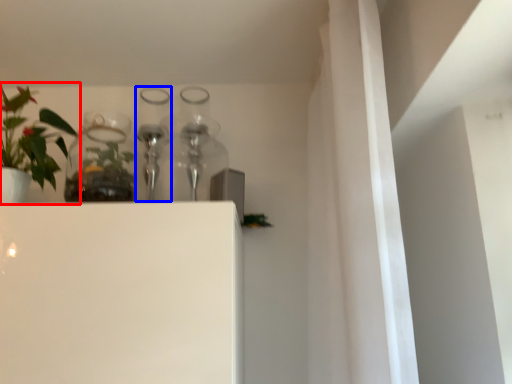
Question: Which object appears farthest to the camera in this image, houseplant (highlighted by a red box) or bottle (highlighted by a blue box)?

Choices:
 (A) houseplant
 (B) bottle

Answer: (B)